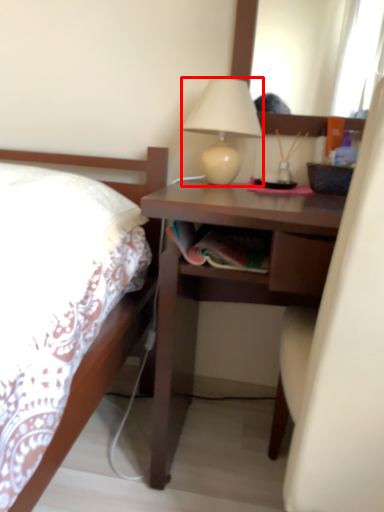
Question: In this image, where is lamp (annotated by the red box) located relative to desk?

Choices:
 (A) right
 (B) left

Answer: (B)